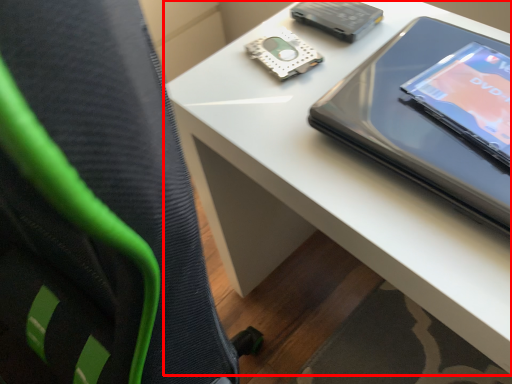
Question: From the image's perspective, considering the relative positions of table (annotated by the red box) and tablet computer in the image provided, where is table (annotated by the red box) located with respect to the staircase?

Choices:
 (A) below
 (B) above

Answer: (A)